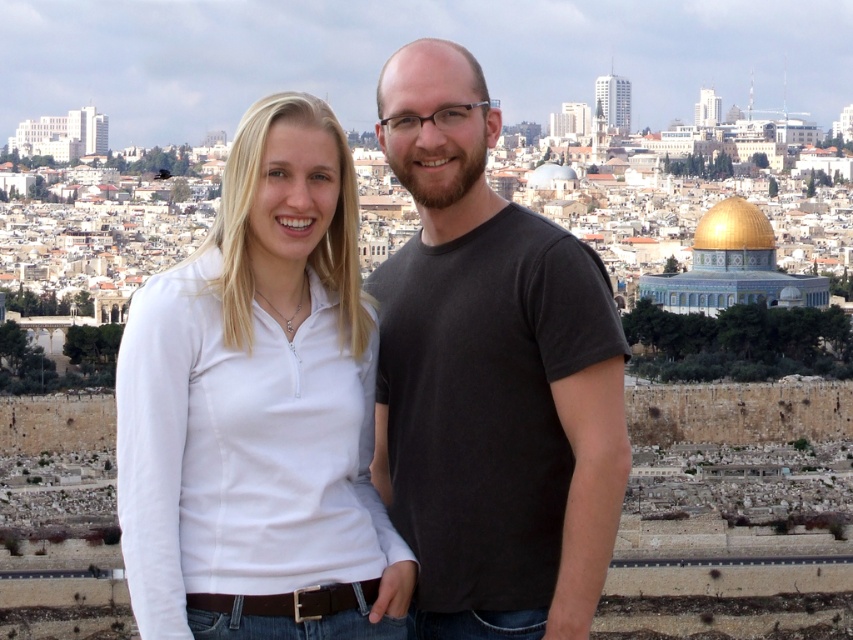
Which is behind, point (242, 419) or point (448, 609)?

The point (448, 609) is more distant.

Who is more forward, (178, 438) or (479, 524)?

Point (178, 438)

The height and width of the screenshot is (640, 853). In order to click on white matte shirt at center in this screenshot , I will do `click(259, 410)`.